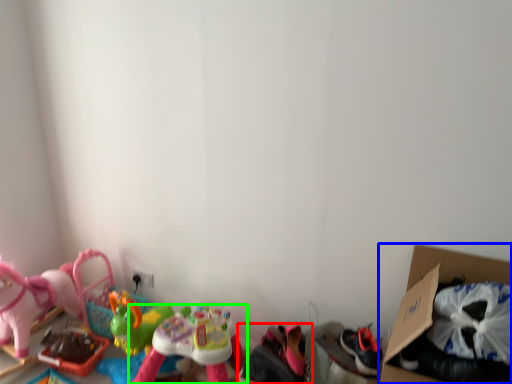
Question: Estimate the real-world distances between objects in this image. Which object is closer to toy (highlighted by a red box), cardboard box (highlighted by a blue box) or toy (highlighted by a green box)?

Choices:
 (A) cardboard box
 (B) toy

Answer: (B)